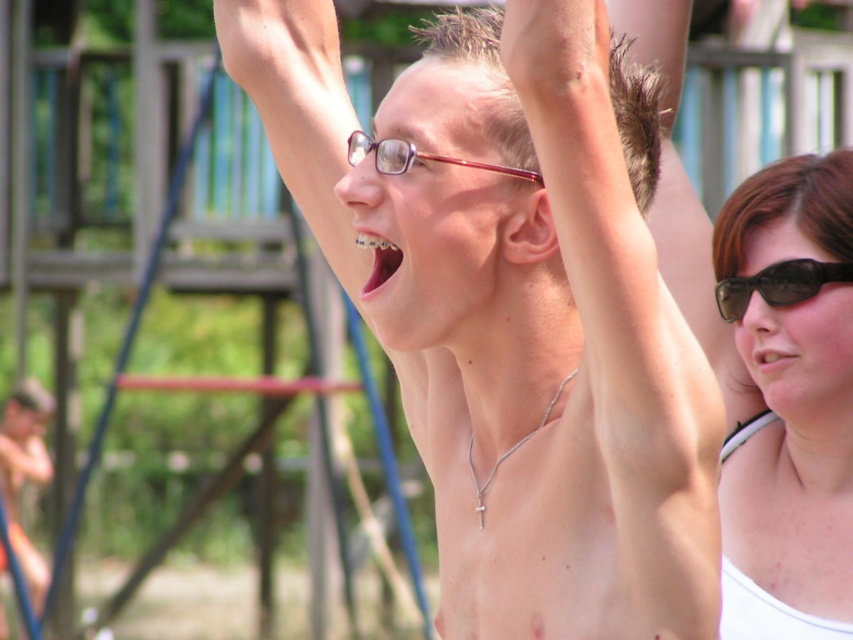
You are a photographer trying to capture a closeup shot of the skinny silver necklace at upper center and the white matte tank top at right. Which object should you zoom in on first to ensure it appears larger in your photo?

The skinny silver necklace at upper center is closer to the viewer than the white matte tank top at right, so you should zoom in on the skinny silver necklace at upper center first to make it appear larger in the photo.

Looking at the scene, where is the white matte tank top at right in relation to the pink glossy teeth at center?

The white matte tank top at right is located to the right of the pink glossy teeth at center.